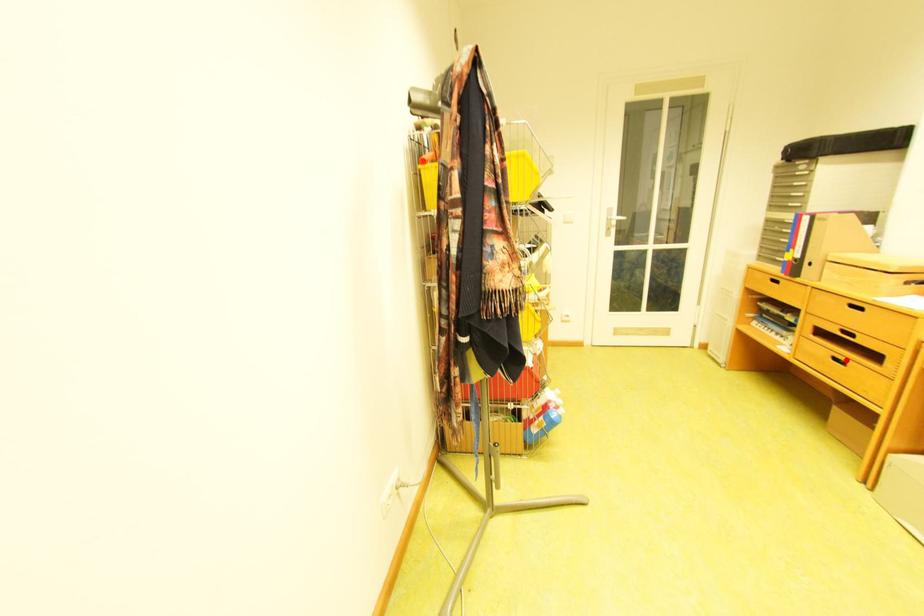
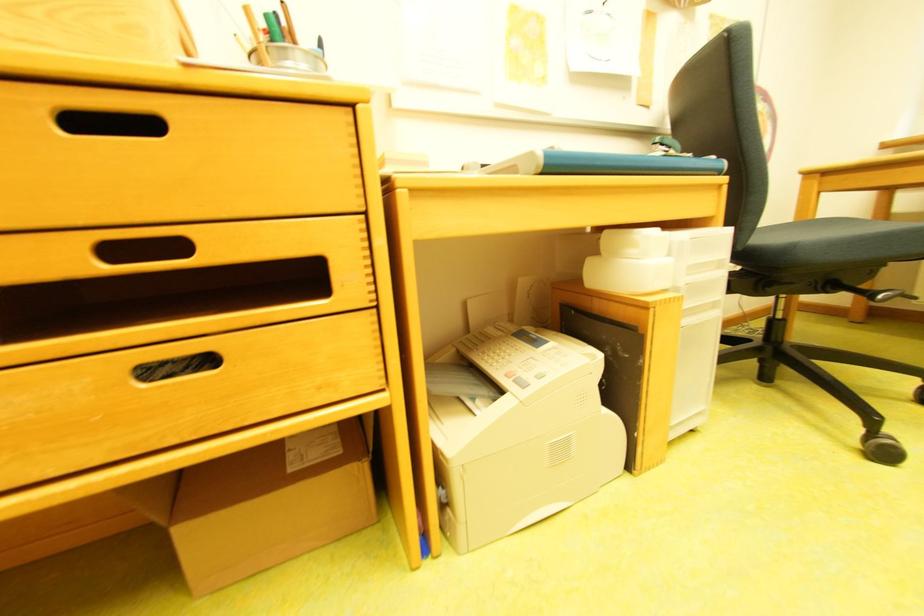
In the second image, find the point that corresponds to the highlighted location in the first image.

(162, 374)